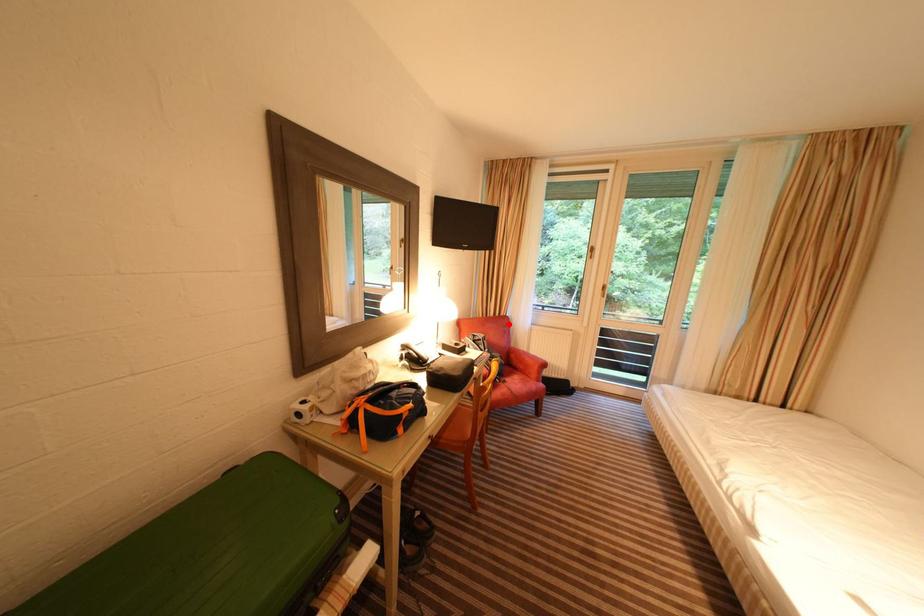
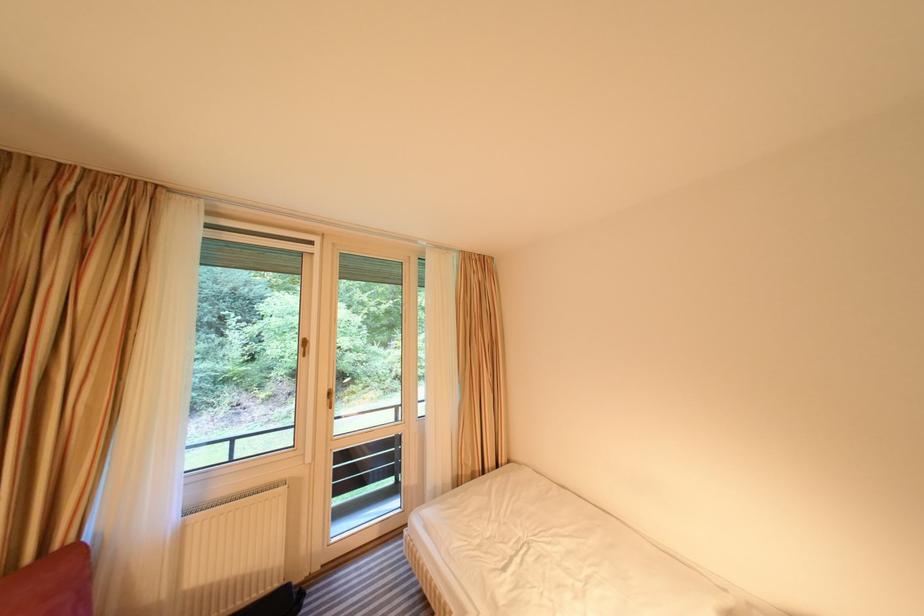
Question: I am providing you with two images of the same scene from different viewpoints. A red point is shown in image1. For the corresponding object point in image2, is it positioned nearer or farther from the camera?

Choices:
 (A) Nearer
 (B) Farther

Answer: (A)